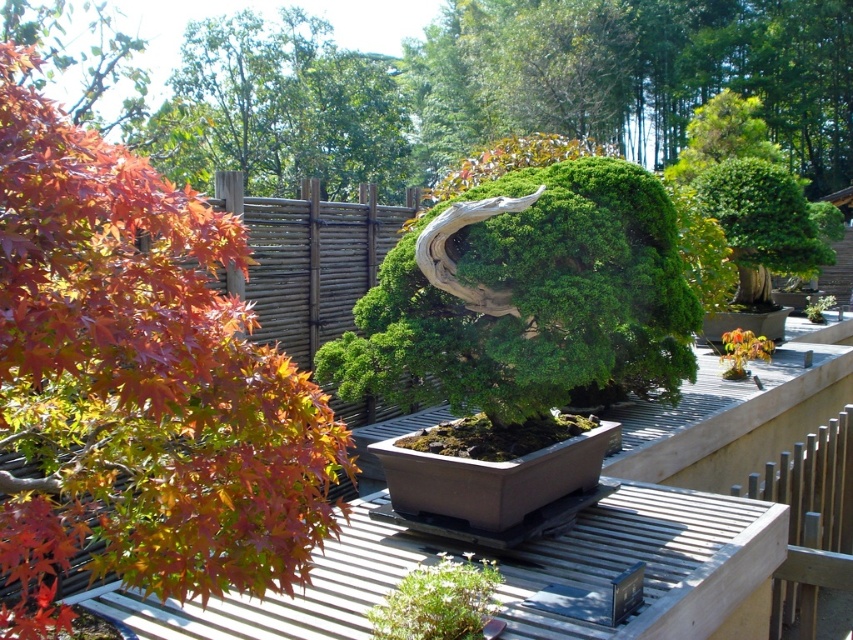
Question: Among these points, which one is farthest from the camera?

Choices:
 (A) (735, 224)
 (B) (28, 218)
 (C) (350, 369)

Answer: (A)

Question: Which point appears closest to the camera in this image?

Choices:
 (A) (428, 300)
 (B) (833, 212)
 (C) (32, 138)

Answer: (C)

Question: Considering the relative positions of green matte bonsai tree at center and green textured bush at upper right in the image provided, where is green matte bonsai tree at center located with respect to green textured bush at upper right?

Choices:
 (A) right
 (B) left

Answer: (B)

Question: Considering the relative positions of green textured bonsai tree at center and green textured bush at upper right in the image provided, where is green textured bonsai tree at center located with respect to green textured bush at upper right?

Choices:
 (A) below
 (B) above

Answer: (A)

Question: Can you confirm if green matte bonsai tree at center is bigger than green textured bush at upper right?

Choices:
 (A) yes
 (B) no

Answer: (B)

Question: Which point is closer to the camera?

Choices:
 (A) (756, 280)
 (B) (318, 493)
 (C) (523, 211)

Answer: (B)